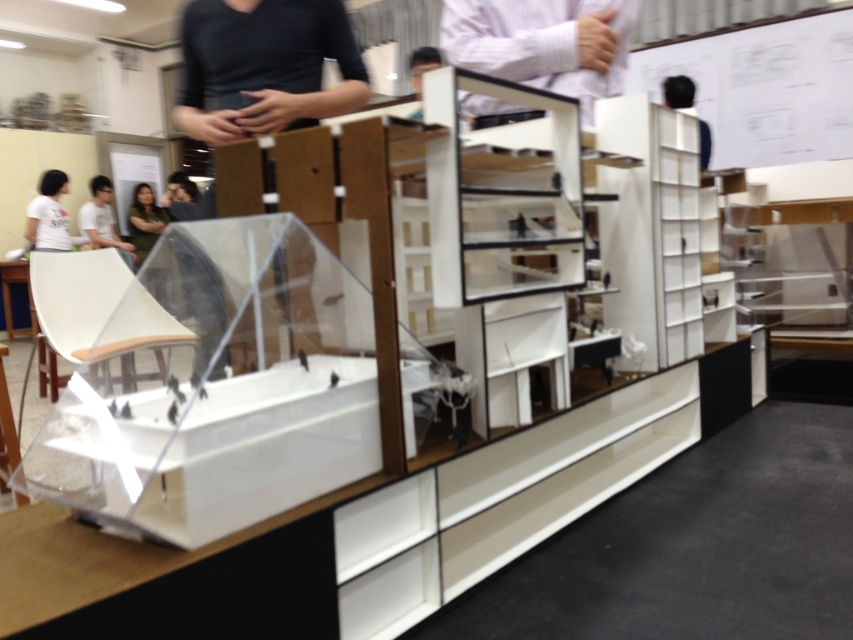
Does white t-shirt at left appear on the right side of matte black shirt at left?

Incorrect, white t-shirt at left is not on the right side of matte black shirt at left.

Can you confirm if white t-shirt at left is positioned above matte black shirt at left?

Yes, white t-shirt at left is above matte black shirt at left.

Does point (50, 173) come behind point (126, 253)?

No, it is in front of (126, 253).

This screenshot has width=853, height=640. I want to click on white t-shirt at left, so click(49, 216).

Find the location of a particular element. green fabric shirt at lower left is located at coordinates (144, 221).

Does point (138, 189) come in front of point (692, 104)?

That is False.

Who is more forward, (148, 221) or (691, 81)?

Point (691, 81) is more forward.

The width and height of the screenshot is (853, 640). Find the location of `green fabric shirt at lower left`. green fabric shirt at lower left is located at coordinates (144, 221).

Is matte black shirt at left below green fabric shirt at lower left?

Indeed, matte black shirt at left is positioned under green fabric shirt at lower left.

Which is behind, point (96, 182) or point (137, 232)?

Positioned behind is point (137, 232).

Where is `matte black shirt at left`? This screenshot has height=640, width=853. matte black shirt at left is located at coordinates (102, 220).